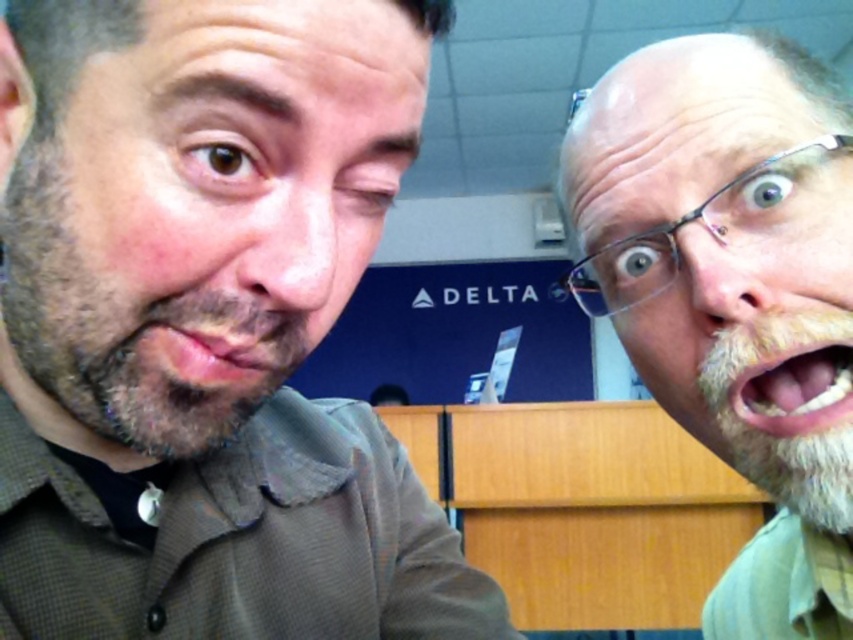
Question: Estimate the real-world distances between objects in this image. Which object is closer to the brown textured shirt at left?

Choices:
 (A) matte brown lips at center
 (B) pink flesh at center
 (C) white beard at right

Answer: (A)

Question: Is brown textured shirt at left to the right of pink flesh at center from the viewer's perspective?

Choices:
 (A) no
 (B) yes

Answer: (A)

Question: Among these points, which one is farthest from the camera?

Choices:
 (A) (715, 250)
 (B) (260, 109)
 (C) (239, 316)
 (D) (793, 406)

Answer: (D)

Question: Which object is farther from the camera taking this photo?

Choices:
 (A) matte brown lips at center
 (B) white beard at right

Answer: (B)

Question: Does matte brown lips at center have a larger size compared to pink flesh at center?

Choices:
 (A) yes
 (B) no

Answer: (A)

Question: Is brown textured shirt at left smaller than matte brown lips at center?

Choices:
 (A) no
 (B) yes

Answer: (A)